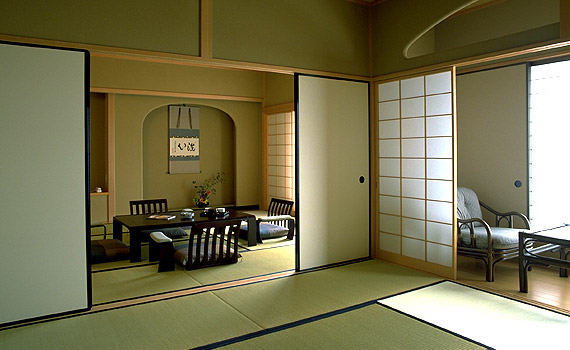
The image size is (570, 350). Identify the location of chair. (498, 230), (195, 245), (152, 205), (279, 213).